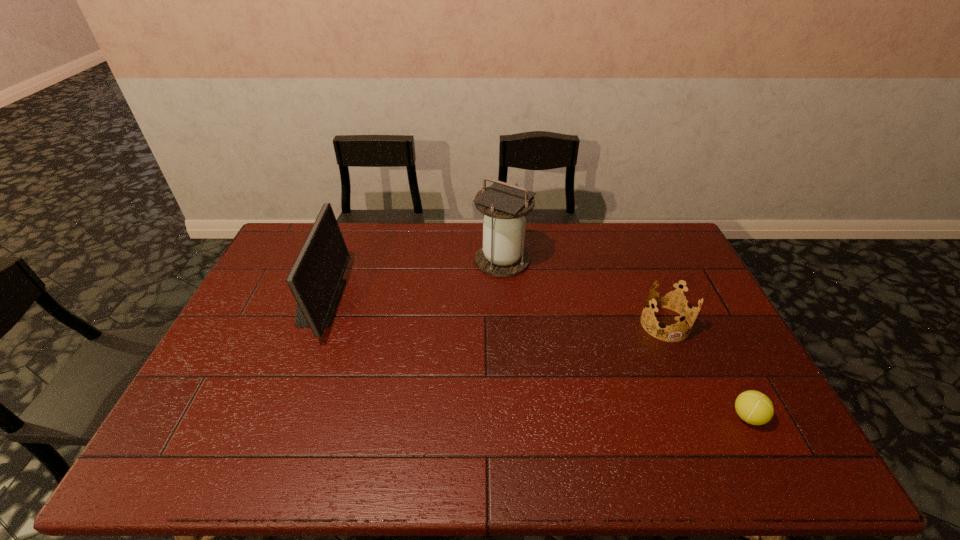
The width and height of the screenshot is (960, 540). I want to click on blank area located 0.080m on the front of the shortest object, so click(772, 464).

Locate an element on the screen. This screenshot has width=960, height=540. object that is at the far edge is located at coordinates (503, 205).

In order to click on object present at the left edge in this screenshot , I will do `click(315, 279)`.

Image resolution: width=960 pixels, height=540 pixels. Identify the location of crown that is at the right edge. point(672,305).

Image resolution: width=960 pixels, height=540 pixels. What are the coordinates of `tennis ball positioned at the right edge` in the screenshot? It's located at (753, 407).

The image size is (960, 540). Identify the location of blank space at the far edge of the desktop. (423, 226).

You are a GUI agent. You are given a task and a screenshot of the screen. Output one action in this format:
    pyautogui.click(x=<x>, y=<y>)
    Task: Click on the vacant space at the near edge of the desktop
    
    Given the screenshot: What is the action you would take?
    482,451

Locate an element on the screen. vacant region at the left edge of the desktop is located at coordinates (244, 424).

Where is `free space between the second tallest object and the nearest object`? The width and height of the screenshot is (960, 540). free space between the second tallest object and the nearest object is located at coordinates (534, 359).

I want to click on empty location between the leftmost object and the second shortest object, so click(x=492, y=313).